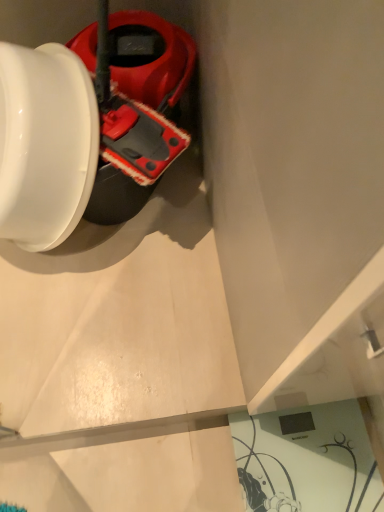
What are the coordinates of `rubberized red mop head at lower left` in the screenshot? It's located at (135, 106).

Based on the photo, what is the approximate height of rubberized red mop head at lower left?

12.30 inches.

What do you see at coordinates (135, 106) in the screenshot? I see `rubberized red mop head at lower left` at bounding box center [135, 106].

Where is `rubberized red mop head at lower left`? rubberized red mop head at lower left is located at coordinates (135, 106).